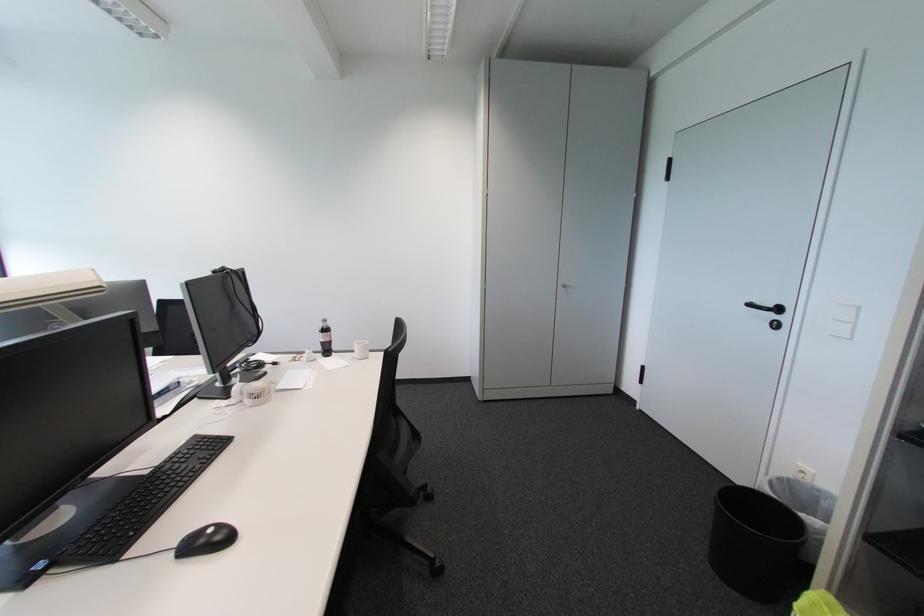
Where is `black computer mouse`? Image resolution: width=924 pixels, height=616 pixels. black computer mouse is located at coordinates (205, 540).